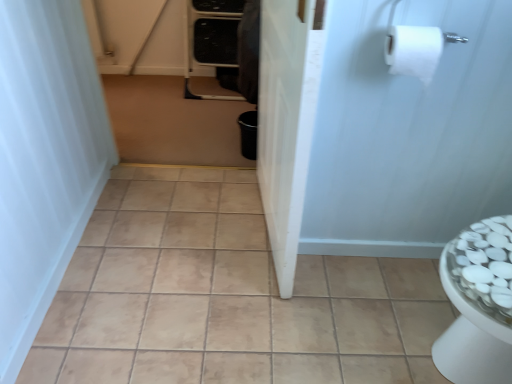
Question: Is white matte shower curtain at left positioned with its back to white matte toilet paper at upper right?

Choices:
 (A) yes
 (B) no

Answer: (B)

Question: Can we say white matte shower curtain at left lies outside white matte toilet paper at upper right?

Choices:
 (A) no
 (B) yes

Answer: (B)

Question: Does white matte shower curtain at left lie in front of white matte toilet paper at upper right?

Choices:
 (A) no
 (B) yes

Answer: (B)

Question: Is white matte shower curtain at left positioned behind white matte toilet paper at upper right?

Choices:
 (A) yes
 (B) no

Answer: (B)

Question: Can you confirm if white matte shower curtain at left is bigger than white matte toilet paper at upper right?

Choices:
 (A) yes
 (B) no

Answer: (A)

Question: Considering the positions of white matte screen door at upper right, which is counted as the first screen door, starting from the right, and brown matte trash can at center in the image, is white matte screen door at upper right, which is counted as the first screen door, starting from the right, wider or thinner than brown matte trash can at center?

Choices:
 (A) wide
 (B) thin

Answer: (B)

Question: Based on their positions, is white matte screen door at upper right, which is counted as the first screen door, starting from the right, located to the left or right of brown matte trash can at center?

Choices:
 (A) right
 (B) left

Answer: (A)

Question: Based on their sizes in the image, would you say white matte screen door at upper right, which is counted as the first screen door, starting from the right, is bigger or smaller than brown matte trash can at center?

Choices:
 (A) small
 (B) big

Answer: (A)

Question: Is point (470, 185) closer or farther from the camera than point (236, 117)?

Choices:
 (A) farther
 (B) closer

Answer: (B)

Question: Looking at their shapes, would you say white matte screen door at upper right, which ranks as the 2th screen door in left-to-right order, is wider or thinner than white matte toilet paper at upper right?

Choices:
 (A) wide
 (B) thin

Answer: (B)

Question: Considering the positions of point (330, 162) and point (421, 56), is point (330, 162) closer or farther from the camera than point (421, 56)?

Choices:
 (A) closer
 (B) farther

Answer: (B)

Question: Considering the relative positions of white matte screen door at upper right, which is counted as the first screen door, starting from the right, and white matte toilet paper at upper right in the image provided, is white matte screen door at upper right, which is counted as the first screen door, starting from the right, to the left or to the right of white matte toilet paper at upper right?

Choices:
 (A) left
 (B) right

Answer: (B)

Question: From a real-world perspective, relative to white matte toilet paper at upper right, is white matte screen door at upper right, which is counted as the first screen door, starting from the right, vertically above or below?

Choices:
 (A) above
 (B) below

Answer: (B)

Question: Considering the positions of white matte toilet paper at upper right and white glossy screen door at center, which is counted as the second screen door, starting from the right, in the image, is white matte toilet paper at upper right taller or shorter than white glossy screen door at center, which is counted as the second screen door, starting from the right,?

Choices:
 (A) tall
 (B) short

Answer: (B)

Question: Does point (418, 46) appear closer or farther from the camera than point (286, 46)?

Choices:
 (A) farther
 (B) closer

Answer: (B)